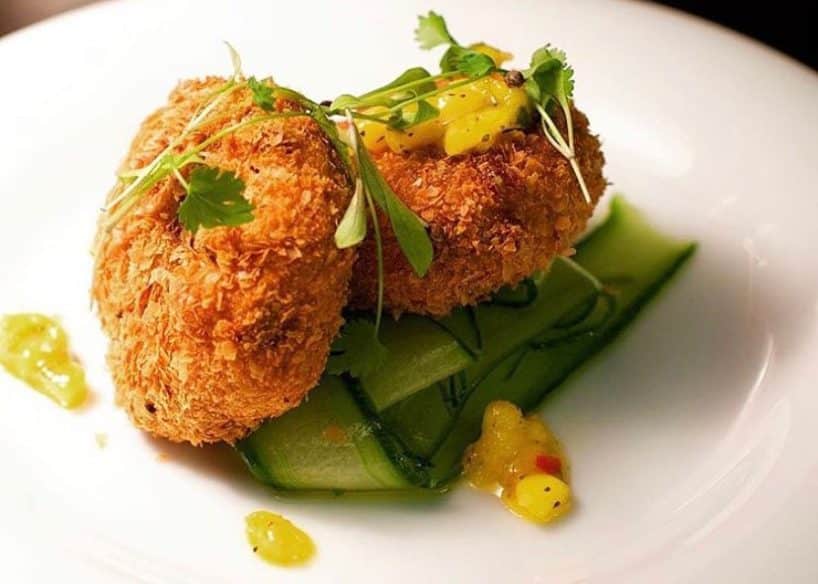
You are a GUI agent. You are given a task and a screenshot of the screen. Output one action in this format:
    pyautogui.click(x=<x>, y=<y>)
    Task: Click on the wet shine on plate
    
    Given the screenshot: What is the action you would take?
    coord(496,491), coord(441,493)